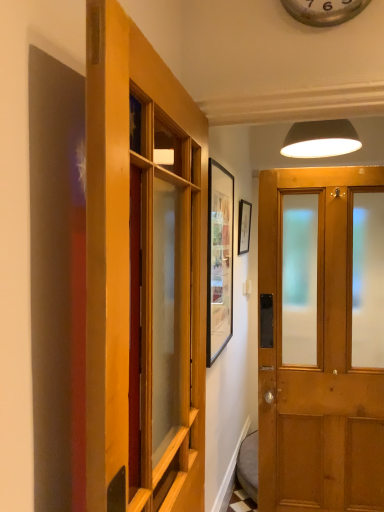
Question: From a real-world perspective, is metallic silver clock at upper center below wooden door at center, arranged as the first door when viewed from the left?

Choices:
 (A) yes
 (B) no

Answer: (B)

Question: Considering the relative sizes of metallic silver clock at upper center and wooden door at center, arranged as the first door when viewed from the left, in the image provided, is metallic silver clock at upper center wider than wooden door at center, arranged as the first door when viewed from the left,?

Choices:
 (A) no
 (B) yes

Answer: (A)

Question: Considering the relative positions of metallic silver clock at upper center and wooden door at center, marked as the second door in a right-to-left arrangement, in the image provided, is metallic silver clock at upper center to the right of wooden door at center, marked as the second door in a right-to-left arrangement, from the viewer's perspective?

Choices:
 (A) no
 (B) yes

Answer: (B)

Question: Is wooden door at center, marked as the second door in a right-to-left arrangement, inside metallic silver clock at upper center?

Choices:
 (A) no
 (B) yes

Answer: (A)

Question: Is metallic silver clock at upper center directly adjacent to wooden door at center, marked as the second door in a right-to-left arrangement?

Choices:
 (A) yes
 (B) no

Answer: (B)

Question: Considering the positions of wooden door at center, marked as the 2th door in a left-to-right arrangement, and matte black lampshade at upper center in the image, is wooden door at center, marked as the 2th door in a left-to-right arrangement, taller or shorter than matte black lampshade at upper center?

Choices:
 (A) tall
 (B) short

Answer: (A)

Question: From a real-world perspective, is wooden door at center, arranged as the first door when viewed from the right, positioned above or below matte black lampshade at upper center?

Choices:
 (A) below
 (B) above

Answer: (A)

Question: Does point (374, 467) appear closer or farther from the camera than point (301, 141)?

Choices:
 (A) farther
 (B) closer

Answer: (B)

Question: From the image's perspective, relative to matte black lampshade at upper center, is wooden door at center, arranged as the first door when viewed from the right, above or below?

Choices:
 (A) above
 (B) below

Answer: (B)

Question: Considering the positions of point (342, 141) and point (345, 280), is point (342, 141) closer or farther from the camera than point (345, 280)?

Choices:
 (A) farther
 (B) closer

Answer: (A)

Question: Considering the positions of matte black lampshade at upper center and wooden door at center, marked as the 2th door in a left-to-right arrangement, in the image, is matte black lampshade at upper center wider or thinner than wooden door at center, marked as the 2th door in a left-to-right arrangement,?

Choices:
 (A) wide
 (B) thin

Answer: (A)

Question: Is matte black lampshade at upper center to the left or to the right of wooden door at center, arranged as the first door when viewed from the right, in the image?

Choices:
 (A) right
 (B) left

Answer: (A)

Question: Relative to wooden door at center, marked as the 2th door in a left-to-right arrangement, is matte black lampshade at upper center in front or behind?

Choices:
 (A) front
 (B) behind

Answer: (B)

Question: Do you think matte black lampshade at upper center is within matte black picture frame at upper center, or outside of it?

Choices:
 (A) inside
 (B) outside

Answer: (B)

Question: In terms of height, does matte black lampshade at upper center look taller or shorter compared to matte black picture frame at upper center?

Choices:
 (A) short
 (B) tall

Answer: (A)